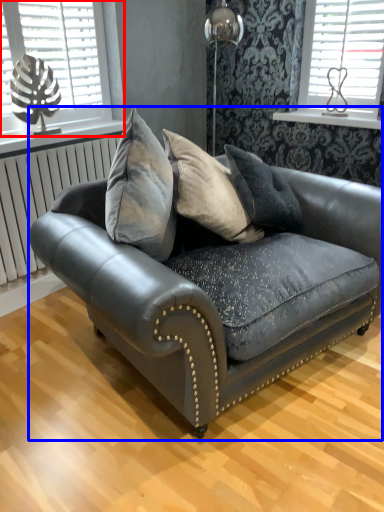
Question: Among these objects, which one is farthest to the camera, window (highlighted by a red box) or studio couch (highlighted by a blue box)?

Choices:
 (A) window
 (B) studio couch

Answer: (A)